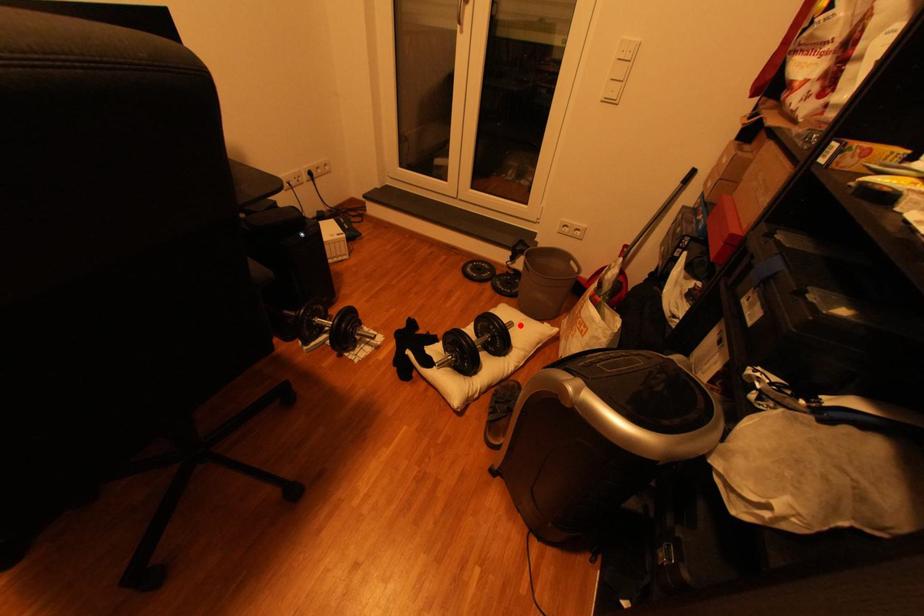
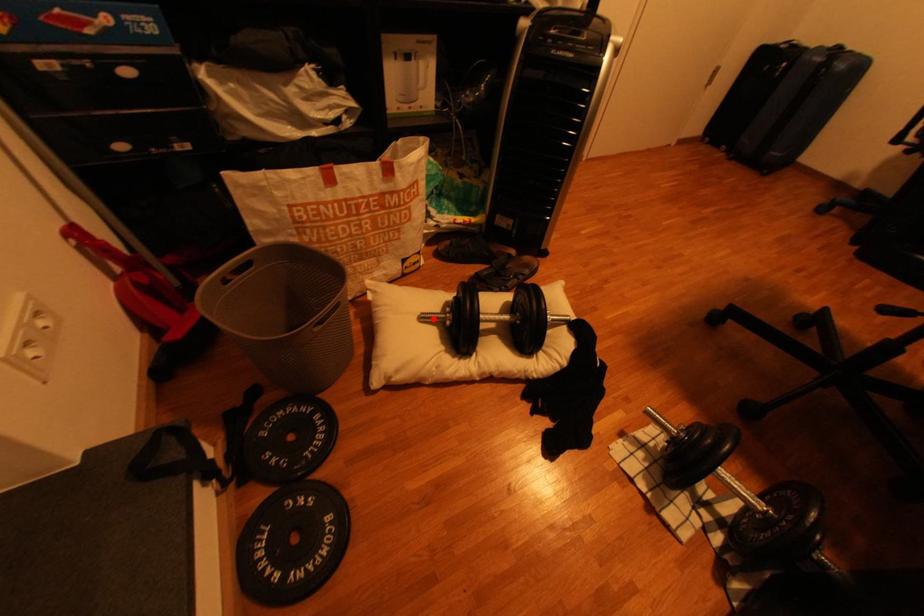
I am providing you with two images of the same scene from different viewpoints. A red point is marked on the first image and another point is marked on the second image. Does the point marked in image1 correspond to the same location as the one in image2?

Yes